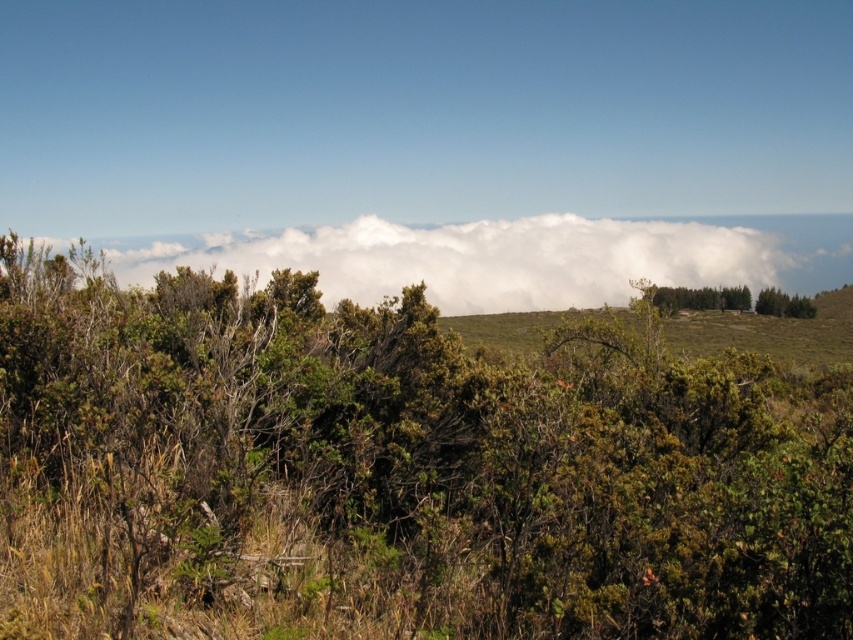
You are a hiker trying to take a photo of the white fluffy cloud at upper center. However, there is a green leafy bush at center blocking your view. Can you move to the left or right to get an unobstructed view of the cloud?

The green leafy bush at center is in front of the white fluffy cloud at upper center, so moving to the left or right may allow you to see around the bush and get an unobstructed view of the cloud.

You are navigating through the landscape and want to move from the point at coordinates point (329, 298) to the point at coordinates point (732, 285). Considering the terrain described, which direction should you move relative to the landscape?

You should move towards the background of the landscape because point (329, 298) is in front of point (732, 285), meaning the latter is located further back in the scene.

You are a hiker trying to find the tallest plant in the scene. Which one is taller between the green leafy bush at center and the green leafy tree at center?

The green leafy tree at center is taller than the green leafy bush at center.